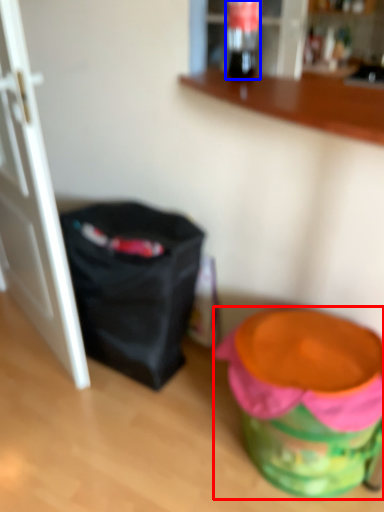
Question: Which object is further to the camera taking this photo, potty (highlighted by a red box) or beverage (highlighted by a blue box)?

Choices:
 (A) potty
 (B) beverage

Answer: (B)